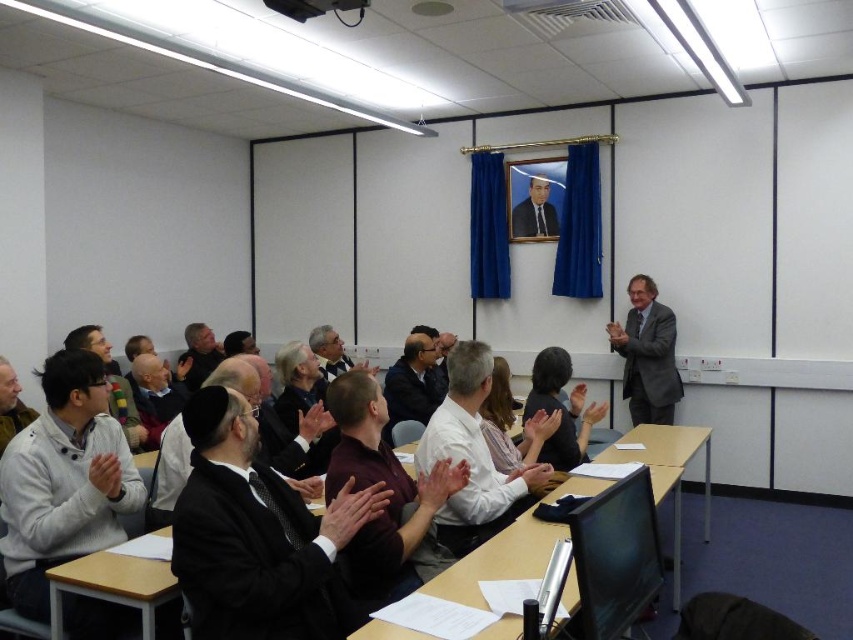
You are a photographer standing at the back of the room. You want to take a photo of the dark brown hair at center without the wooden table at center blocking the view. Is this possible?

The wooden table at center is in front of the dark brown hair at center, so the table will block the view of the dark brown hair at center. You cannot take a clear photo without the table obstructing it.